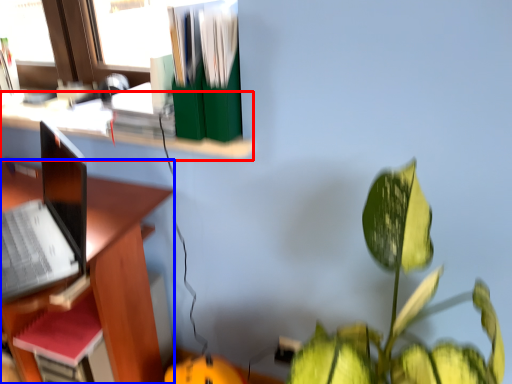
Question: Which point is closer to the camera, shelf (highlighted by a red box) or desk (highlighted by a blue box)?

Choices:
 (A) shelf
 (B) desk

Answer: (B)